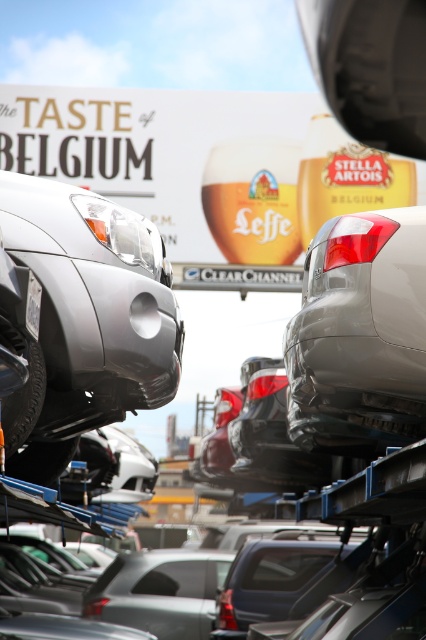
You are a delivery person trying to load a package onto the white plastic license plate at center. The package is 2 inches thick. Can you place it there without exceeding the height limit imposed by the satin silver car at upper right?

The satin silver car at upper right has a greater height compared to the white plastic license plate at center. Since the car is taller, the package of 2 inches thickness can be placed on the white plastic license plate at center without exceeding the height limit imposed by the car.

You are a delivery person who needs to load a package onto a shelf that is 1.5 meters high. You have to choose between placing it on the satin silver car at left or the white plastic license plate at center. Which object can support the package at that height?

The satin silver car at left is much taller than the white plastic license plate at center, so the package can be placed on the satin silver car at left since it reaches the required height of 1.5 meters.